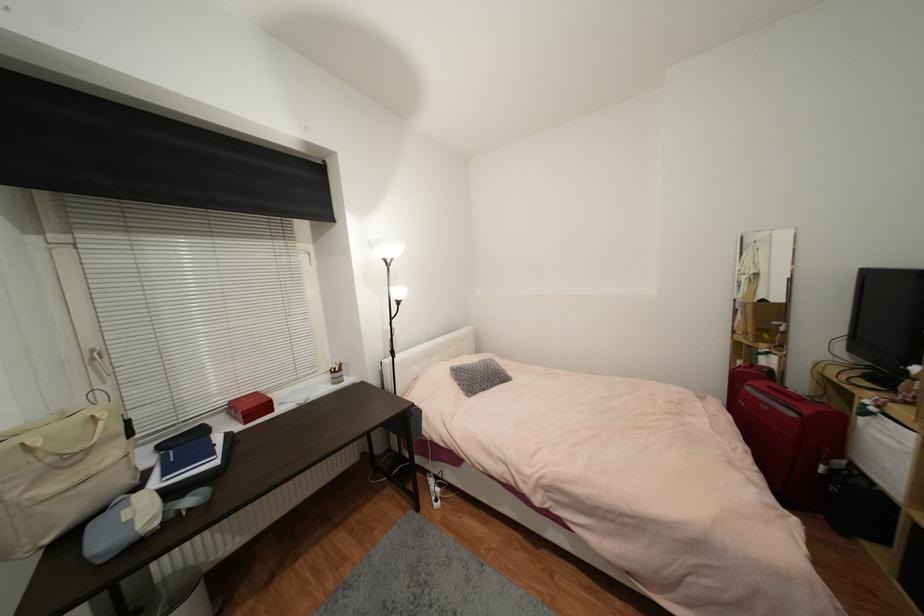
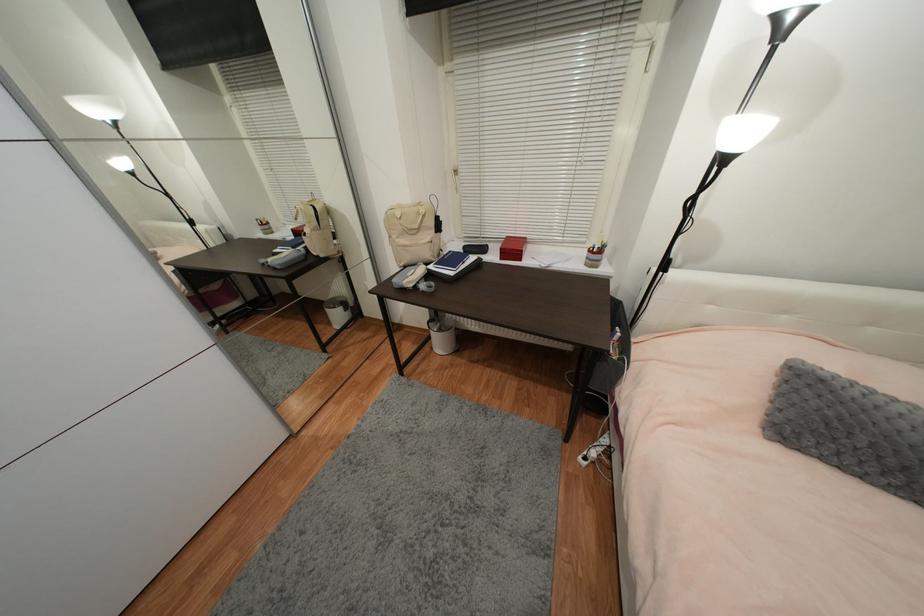
Based on the continuous images, in which direction is the camera rotating?

The camera's rotation is toward left-down.